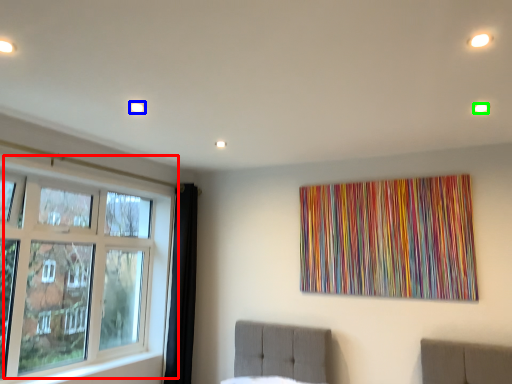
Question: Which object is positioned closest to window (highlighted by a red box)? Select from light (highlighted by a blue box) and light (highlighted by a green box).

Choices:
 (A) light
 (B) light

Answer: (A)